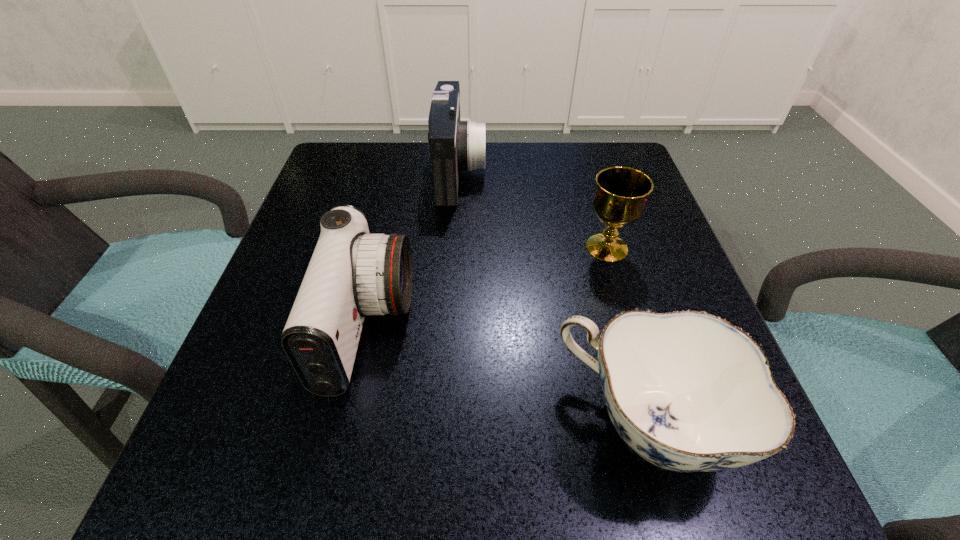
You are a GUI agent. You are given a task and a screenshot of the screen. Output one action in this format:
    pyautogui.click(x=<x>, y=<y>)
    Task: Click on the free space between the chalice and the farther camcorder
    This screenshot has width=960, height=540.
    Given the screenshot: What is the action you would take?
    (x=533, y=210)

Locate an element on the screen. The image size is (960, 540). free spot between the nearer camcorder and the chinaware is located at coordinates (507, 376).

Find the location of a particular element. This screenshot has height=540, width=960. object that can be found as the second closest to the chalice is located at coordinates click(x=687, y=391).

Choose which object is the second nearest neighbor to the right camcorder. Please provide its 2D coordinates. Your answer should be formatted as a tuple, i.e. [(x, y)], where the tuple contains the x and y coordinates of a point satisfying the conditions above.

[(621, 194)]

Locate an element on the screen. This screenshot has width=960, height=540. vacant area that satisfies the following two spatial constraints: 1. on the lens of the chinaware; 2. on the right side of the farthest object is located at coordinates (444, 424).

Locate an element on the screen. Image resolution: width=960 pixels, height=540 pixels. vacant space that satisfies the following two spatial constraints: 1. on the surface of the chinaware; 2. on the left side of the nearer camcorder is located at coordinates (348, 424).

Find the location of a particular element. Image resolution: width=960 pixels, height=540 pixels. vacant area in the image that satisfies the following two spatial constraints: 1. on the lens of the chinaware; 2. on the right side of the farthest object is located at coordinates (444, 424).